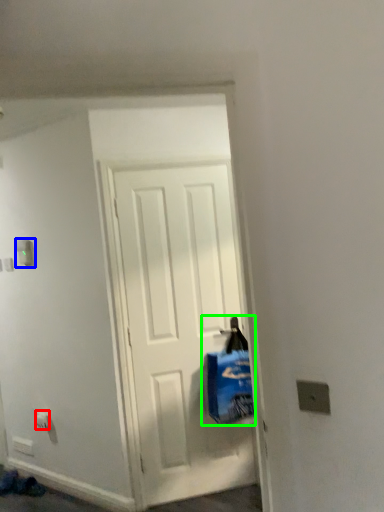
Question: Which object is the closest to the electric outlet (highlighted by a red box)? Choose among these: light switch (highlighted by a blue box) or shopping bag (highlighted by a green box).

Choices:
 (A) light switch
 (B) shopping bag

Answer: (A)